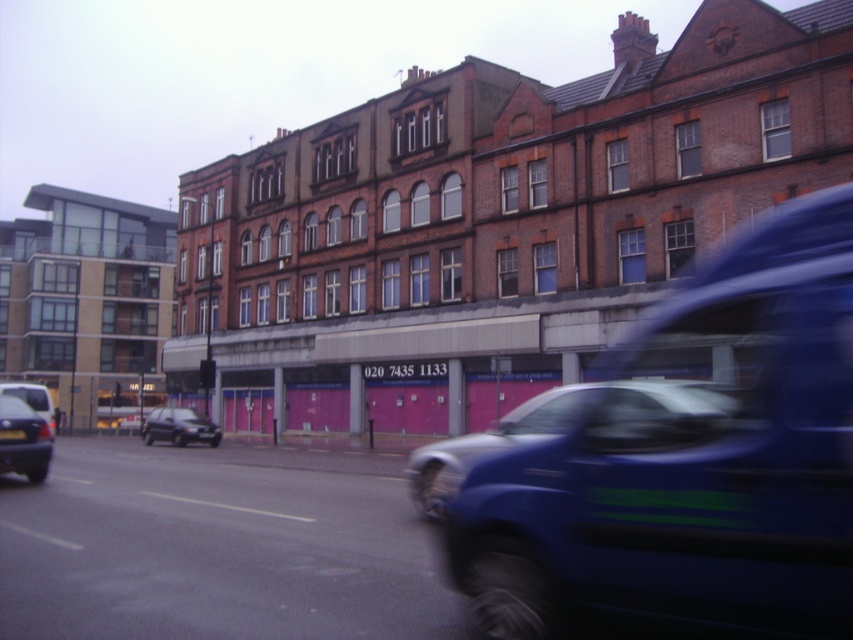
Question: Which of the following is the closest to the observer?

Choices:
 (A) black plastic license plate at center
 (B) shiny black car at center-left
 (C) matte black van at left
 (D) metallic blue van at center

Answer: (D)

Question: Is black metallic car at lower left above black plastic license plate at center?

Choices:
 (A) no
 (B) yes

Answer: (A)

Question: Is metallic blue car at center further to camera compared to black plastic license plate at center?

Choices:
 (A) no
 (B) yes

Answer: (A)

Question: Is metallic blue van at center to the left of shiny black car at center-left from the viewer's perspective?

Choices:
 (A) yes
 (B) no

Answer: (B)

Question: Which of the following is the farthest from the observer?

Choices:
 (A) [x=537, y=432]
 (B) [x=784, y=586]
 (C) [x=173, y=417]

Answer: (C)

Question: Among these objects, which one is farthest from the camera?

Choices:
 (A) metallic blue car at center
 (B) matte black van at left
 (C) black plastic license plate at center

Answer: (B)